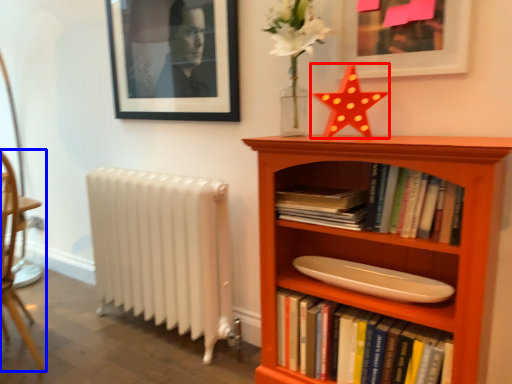
Question: Which point is further to the camera, chiffonier (highlighted by a red box) or chair (highlighted by a blue box)?

Choices:
 (A) chiffonier
 (B) chair

Answer: (B)